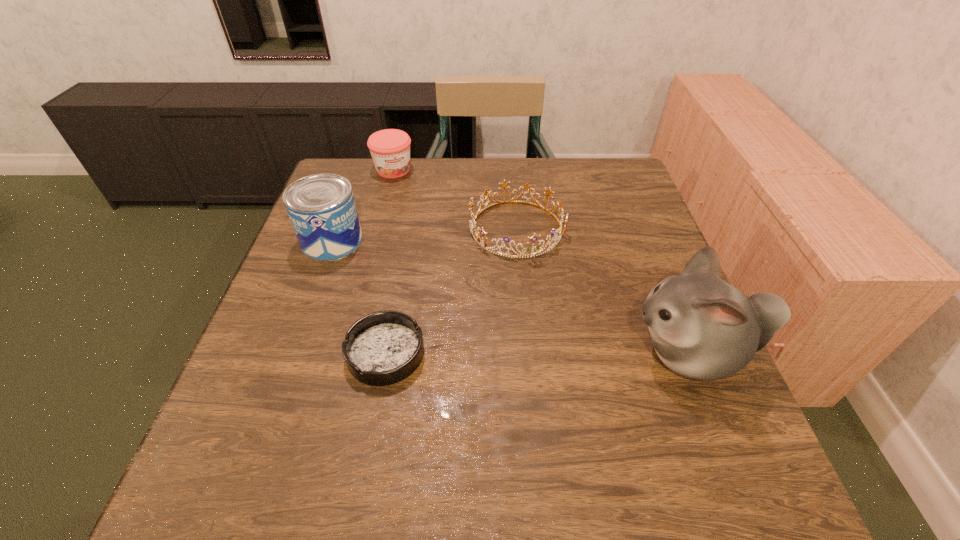
At what (x,y) coordinates should I click in order to perform the action: click on vacant area that lies between the ashtray and the hamster. Please return your answer as a coordinate pair (x, y). This screenshot has height=540, width=960. Looking at the image, I should click on tap(539, 354).

Identify the location of blank region between the tiara and the rightmost object. Image resolution: width=960 pixels, height=540 pixels. (604, 291).

Where is `vacant space that is in between the shortest object and the third tallest object`? Image resolution: width=960 pixels, height=540 pixels. vacant space that is in between the shortest object and the third tallest object is located at coordinates pyautogui.click(x=390, y=261).

Where is `object that can be found as the closest to the fourth shortest object`? The width and height of the screenshot is (960, 540). object that can be found as the closest to the fourth shortest object is located at coordinates (382, 348).

Identify the location of the closest object to the second object from right to left. The width and height of the screenshot is (960, 540). (701, 327).

Identify the location of free spot that satisfies the following two spatial constraints: 1. on the front side of the third shortest object; 2. on the left side of the ashtray. (346, 354).

The image size is (960, 540). I want to click on free spot that satisfies the following two spatial constraints: 1. on the front side of the farthest object; 2. on the right side of the second object from right to left, so click(378, 228).

Identify the location of free space that satisfies the following two spatial constraints: 1. on the front side of the farthest object; 2. on the face of the tallest object. (346, 353).

Locate an element on the screen. Image resolution: width=960 pixels, height=540 pixels. vacant area that satisfies the following two spatial constraints: 1. on the front side of the can; 2. on the left side of the ashtray is located at coordinates pos(292,354).

This screenshot has width=960, height=540. In order to click on free location that satisfies the following two spatial constraints: 1. on the front side of the can; 2. on the face of the hamster in this screenshot , I will do point(292,353).